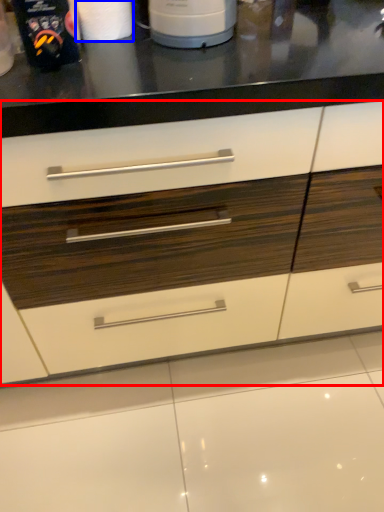
Question: Which object is further to the camera taking this photo, drawer (highlighted by a red box) or paper towel (highlighted by a blue box)?

Choices:
 (A) drawer
 (B) paper towel

Answer: (B)